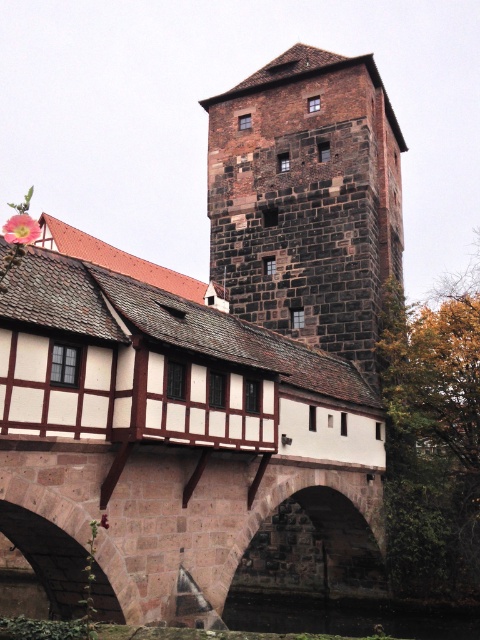
Between point (300, 81) and point (88, 444), which one is positioned behind?

Positioned behind is point (300, 81).

The width and height of the screenshot is (480, 640). In order to click on dark brown stone tower at upper center in this screenshot , I will do `click(307, 198)`.

Which is in front, point (124, 596) or point (305, 598)?

Point (124, 596)

Is point (141, 486) in front of point (403, 634)?

Yes.

Where is `brown stone bridge at center`? This screenshot has height=640, width=480. brown stone bridge at center is located at coordinates (177, 524).

Which is above, dark brown stone tower at upper center or black stone river at lower center?

dark brown stone tower at upper center is higher up.

Does dark brown stone tower at upper center have a greater height compared to black stone river at lower center?

Correct, dark brown stone tower at upper center is much taller as black stone river at lower center.

At what (x,y) coordinates should I click in order to perform the action: click on dark brown stone tower at upper center. Please return your answer as a coordinate pair (x, y). The height and width of the screenshot is (640, 480). Looking at the image, I should click on (307, 198).